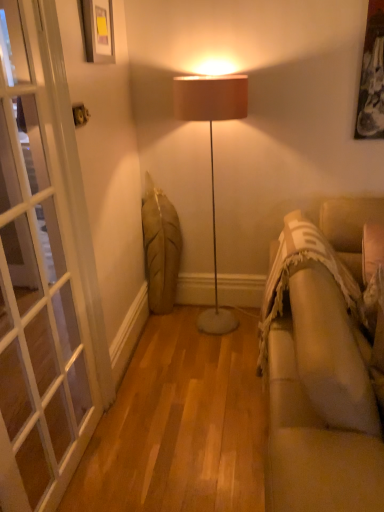
Question: From the image's perspective, does white glass screen door at left appear lower than matte black picture frame at upper left?

Choices:
 (A) no
 (B) yes

Answer: (B)

Question: From a real-world perspective, is white glass screen door at left below matte black picture frame at upper left?

Choices:
 (A) no
 (B) yes

Answer: (B)

Question: From the image's perspective, is white glass screen door at left located above matte black picture frame at upper left?

Choices:
 (A) yes
 (B) no

Answer: (B)

Question: Is white glass screen door at left at the right side of matte black picture frame at upper left?

Choices:
 (A) yes
 (B) no

Answer: (B)

Question: Is white glass screen door at left shorter than matte black picture frame at upper left?

Choices:
 (A) no
 (B) yes

Answer: (A)

Question: Relative to white glass screen door at left, is matte black picture frame at upper left in front or behind?

Choices:
 (A) front
 (B) behind

Answer: (B)

Question: From a real-world perspective, is matte black picture frame at upper left physically located above or below white glass screen door at left?

Choices:
 (A) above
 (B) below

Answer: (A)

Question: In the image, is matte black picture frame at upper left on the left side or the right side of white glass screen door at left?

Choices:
 (A) left
 (B) right

Answer: (B)

Question: Is matte black picture frame at upper left inside or outside of white glass screen door at left?

Choices:
 (A) inside
 (B) outside

Answer: (B)

Question: From the image's perspective, relative to beige fabric couch at right, is white glass screen door at left above or below?

Choices:
 (A) below
 (B) above

Answer: (B)

Question: Is white glass screen door at left bigger or smaller than beige fabric couch at right?

Choices:
 (A) big
 (B) small

Answer: (B)

Question: Considering the positions of white glass screen door at left and beige fabric couch at right in the image, is white glass screen door at left taller or shorter than beige fabric couch at right?

Choices:
 (A) short
 (B) tall

Answer: (B)

Question: Relative to beige fabric couch at right, is white glass screen door at left in front or behind?

Choices:
 (A) front
 (B) behind

Answer: (B)

Question: Is beige fabric couch at right taller or shorter than white glass screen door at left?

Choices:
 (A) tall
 (B) short

Answer: (B)

Question: Is beige fabric couch at right situated inside white glass screen door at left or outside?

Choices:
 (A) outside
 (B) inside

Answer: (A)